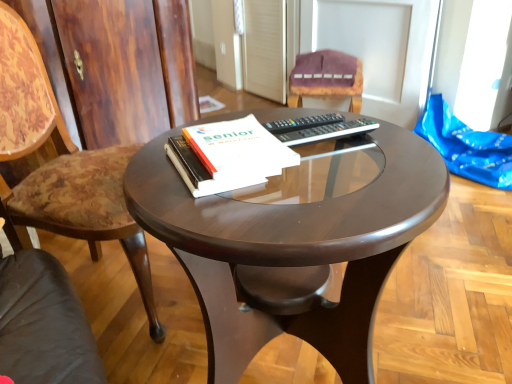
What do you see at coordinates (239, 149) in the screenshot? This screenshot has width=512, height=384. I see `white paper at center` at bounding box center [239, 149].

Identify the location of glossy wood coffee table at center. (295, 242).

What do you see at coordinates (61, 165) in the screenshot?
I see `wooden chair at left, the first chair viewed from the front` at bounding box center [61, 165].

What is the approximate width of black plastic remote at center?

black plastic remote at center is 9.35 inches in width.

Where is `white paper at center`? Image resolution: width=512 pixels, height=384 pixels. white paper at center is located at coordinates (239, 149).

Is white paper at center further to camera compared to wooden chair at left, which is the second chair from right to left?

No, white paper at center is closer to the camera.

Looking at the image, does white paper at center seem bigger or smaller compared to wooden chair at left, the first chair viewed from the front?

white paper at center is smaller than wooden chair at left, the first chair viewed from the front.

Is white paper at center facing away from wooden chair at left, which is the second chair from right to left?

No, wooden chair at left, which is the second chair from right to left, is not at the back of white paper at center.

Consider the image. Does white paper at center contain wooden chair at left, the first chair viewed from the front?

No, wooden chair at left, the first chair viewed from the front, is located outside of white paper at center.

Looking at this image, is wooden chair at left, which is the 2th chair in back-to-front order, placed right next to black plastic remote at center?

No, wooden chair at left, which is the 2th chair in back-to-front order, is not beside black plastic remote at center.

Which of these two, wooden chair at left, the first chair viewed from the front, or black plastic remote at center, is thinner?

black plastic remote at center is thinner.

Based on the photo, considering the relative positions of wooden chair at left, which is the second chair from right to left, and black plastic remote at center in the image provided, is wooden chair at left, which is the second chair from right to left, to the right of black plastic remote at center from the viewer's perspective?

In fact, wooden chair at left, which is the second chair from right to left, is to the left of black plastic remote at center.

Looking at this image, is wooden chair at left, which is the 2th chair in back-to-front order, oriented towards black plastic remote at center?

Yes, wooden chair at left, which is the 2th chair in back-to-front order, is turned towards black plastic remote at center.

Who is taller, glossy wood coffee table at center or white paper at center?

glossy wood coffee table at center is taller.

Is glossy wood coffee table at center to the right of white paper at center from the viewer's perspective?

Yes.

Consider the image. Is glossy wood coffee table at center inside the boundaries of white paper at center, or outside?

glossy wood coffee table at center is not inside white paper at center, it's outside.

How distant is black plastic remote at center from velvet purple chair at upper center, the 1th chair viewed from the right?

black plastic remote at center is 4.35 feet away from velvet purple chair at upper center, the 1th chair viewed from the right.

Is black plastic remote at center positioned before velvet purple chair at upper center, the 2th chair when ordered from left to right?

Yes, black plastic remote at center is closer to the camera.

Is black plastic remote at center bigger than velvet purple chair at upper center, arranged as the 1th chair when viewed from the back?

Incorrect, black plastic remote at center is not larger than velvet purple chair at upper center, arranged as the 1th chair when viewed from the back.

Is black plastic remote at center wider than velvet purple chair at upper center, the 2th chair when ordered from left to right?

No, black plastic remote at center is not wider than velvet purple chair at upper center, the 2th chair when ordered from left to right.

From the image's perspective, does velvet purple chair at upper center, the 2th chair when ordered from left to right, appear lower than white paper at center?

No, from the image's perspective, velvet purple chair at upper center, the 2th chair when ordered from left to right, is not beneath white paper at center.

Can you confirm if velvet purple chair at upper center, arranged as the 1th chair when viewed from the back, is wider than white paper at center?

Indeed, velvet purple chair at upper center, arranged as the 1th chair when viewed from the back, has a greater width compared to white paper at center.

Does point (357, 58) come in front of point (224, 147)?

No, (357, 58) is behind (224, 147).

Looking at this image, what's the angular difference between black plastic remote at center and glossy wood coffee table at center's facing directions?

11.3 degrees separate the facing orientations of black plastic remote at center and glossy wood coffee table at center.

Can you confirm if black plastic remote at center is shorter than glossy wood coffee table at center?

Yes.

Considering the sizes of black plastic remote at center and glossy wood coffee table at center in the image, is black plastic remote at center bigger or smaller than glossy wood coffee table at center?

In the image, black plastic remote at center appears to be smaller than glossy wood coffee table at center.

Could you tell me if black plastic remote at center is facing glossy wood coffee table at center?

Yes, black plastic remote at center faces towards glossy wood coffee table at center.

From the image's perspective, does glossy wood coffee table at center appear lower than velvet purple chair at upper center, arranged as the 1th chair when viewed from the back?

Yes.

Does glossy wood coffee table at center appear on the right side of velvet purple chair at upper center, the 2th chair when ordered from left to right?

Incorrect, glossy wood coffee table at center is not on the right side of velvet purple chair at upper center, the 2th chair when ordered from left to right.

Locate an element on the screen. This screenshot has width=512, height=384. coffee table on the left side of velvet purple chair at upper center, which is the 2th chair from front to back is located at coordinates (295, 242).

Which object is further away from the camera taking this photo, glossy wood coffee table at center or velvet purple chair at upper center, arranged as the 1th chair when viewed from the back?

velvet purple chair at upper center, arranged as the 1th chair when viewed from the back, is further from the camera.

Where is `paperback book located above the wooden chair at left, which is the 2th chair in back-to-front order (from a real-world perspective)`? The image size is (512, 384). paperback book located above the wooden chair at left, which is the 2th chair in back-to-front order (from a real-world perspective) is located at coordinates (239, 149).

The height and width of the screenshot is (384, 512). I want to click on chair that appears below the black plastic remote at center (from the image's perspective), so click(61, 165).

Which object lies further to the anchor point black plastic remote at center, white paper at center or wooden chair at left, positioned as the first chair in left-to-right order?

Among the two, wooden chair at left, positioned as the first chair in left-to-right order, is located further to black plastic remote at center.

Based on their spatial positions, is glossy wood coffee table at center or velvet purple chair at upper center, the 2th chair when ordered from left to right, closer to black plastic remote at center?

glossy wood coffee table at center.

Based on their spatial positions, is black plastic remote at center or wooden chair at left, positioned as the first chair in left-to-right order, closer to glossy wood coffee table at center?

black plastic remote at center.

Estimate the real-world distances between objects in this image. Which object is further from wooden chair at left, the first chair viewed from the front, glossy wood coffee table at center or white paper at center?

Based on the image, white paper at center appears to be further to wooden chair at left, the first chair viewed from the front.

From the image, which object appears to be farther from glossy wood coffee table at center, white paper at center or wooden chair at left, which is the second chair from right to left?

wooden chair at left, which is the second chair from right to left, lies further to glossy wood coffee table at center than the other object.

Estimate the real-world distances between objects in this image. Which object is closer to white paper at center, black plastic remote at center or wooden chair at left, positioned as the first chair in left-to-right order?

black plastic remote at center lies closer to white paper at center than the other object.

Which object lies further to the anchor point white paper at center, glossy wood coffee table at center or wooden chair at left, positioned as the first chair in left-to-right order?

wooden chair at left, positioned as the first chair in left-to-right order, is further to white paper at center.

When comparing their distances from velvet purple chair at upper center, arranged as the 1th chair when viewed from the back, does glossy wood coffee table at center or black plastic remote at center seem closer?

Based on the image, black plastic remote at center appears to be nearer to velvet purple chair at upper center, arranged as the 1th chair when viewed from the back.

This screenshot has height=384, width=512. I want to click on coffee table situated between wooden chair at left, the first chair viewed from the front, and black plastic remote at center from left to right, so click(295, 242).

The width and height of the screenshot is (512, 384). Find the location of `remote between wooden chair at left, which is the second chair from right to left, and velvet purple chair at upper center, arranged as the 1th chair when viewed from the back, in the front-back direction`. remote between wooden chair at left, which is the second chair from right to left, and velvet purple chair at upper center, arranged as the 1th chair when viewed from the back, in the front-back direction is located at coordinates (328, 132).

Locate an element on the screen. chair between glossy wood coffee table at center and velvet purple chair at upper center, arranged as the 1th chair when viewed from the back, from front to back is located at coordinates (61, 165).

The height and width of the screenshot is (384, 512). Find the location of `paperback book situated between wooden chair at left, which is the second chair from right to left, and glossy wood coffee table at center from left to right`. paperback book situated between wooden chair at left, which is the second chair from right to left, and glossy wood coffee table at center from left to right is located at coordinates [x=239, y=149].